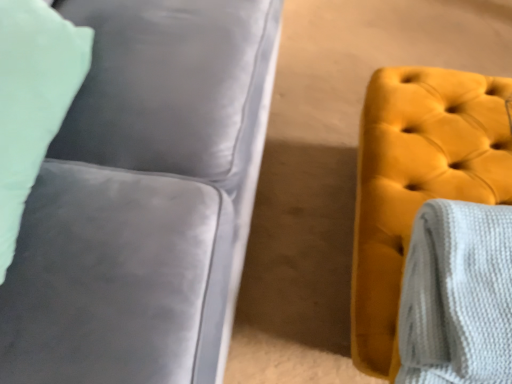
Question: From a real-world perspective, is velvet yellow ottoman at right on satin gray couch at left?

Choices:
 (A) yes
 (B) no

Answer: (B)

Question: Would you say satin gray couch at left is part of velvet yellow ottoman at right's contents?

Choices:
 (A) yes
 (B) no

Answer: (B)

Question: Does velvet yellow ottoman at right have a greater height compared to satin gray couch at left?

Choices:
 (A) no
 (B) yes

Answer: (A)

Question: Is velvet yellow ottoman at right smaller than satin gray couch at left?

Choices:
 (A) no
 (B) yes

Answer: (B)

Question: From a real-world perspective, is velvet yellow ottoman at right under satin gray couch at left?

Choices:
 (A) yes
 (B) no

Answer: (A)

Question: Is velvet yellow ottoman at right oriented towards satin gray couch at left?

Choices:
 (A) no
 (B) yes

Answer: (A)

Question: From a real-world perspective, is satin gray couch at left located higher than velvet yellow ottoman at right?

Choices:
 (A) no
 (B) yes

Answer: (B)

Question: Does satin gray couch at left turn towards velvet yellow ottoman at right?

Choices:
 (A) yes
 (B) no

Answer: (A)

Question: Considering the relative sizes of satin gray couch at left and velvet yellow ottoman at right in the image provided, is satin gray couch at left taller than velvet yellow ottoman at right?

Choices:
 (A) yes
 (B) no

Answer: (A)

Question: Is velvet yellow ottoman at right completely or partially inside satin gray couch at left?

Choices:
 (A) no
 (B) yes

Answer: (A)

Question: Is satin gray couch at left completely or partially outside of velvet yellow ottoman at right?

Choices:
 (A) no
 (B) yes

Answer: (B)

Question: Does satin gray couch at left have a smaller size compared to velvet yellow ottoman at right?

Choices:
 (A) no
 (B) yes

Answer: (A)

Question: From the image's perspective, is white textured blanket at right located beneath satin gray couch at left?

Choices:
 (A) yes
 (B) no

Answer: (A)